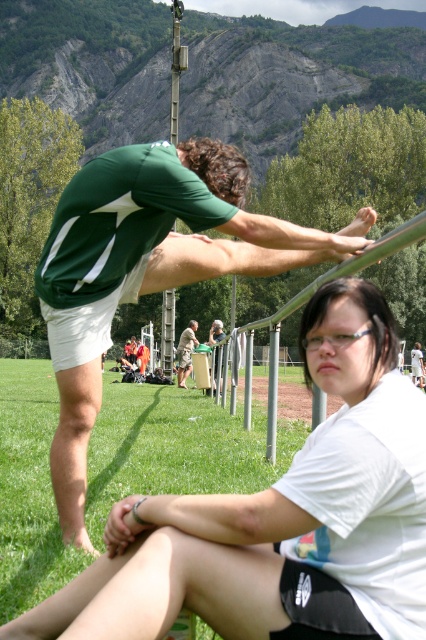
Question: Does white matte shirt at lower center appear over green fabric shirt at upper left?

Choices:
 (A) no
 (B) yes

Answer: (A)

Question: Which point is farther to the camera?

Choices:
 (A) white matte shirt at lower center
 (B) green fabric shirt at upper left
 (C) wooden bench at center

Answer: (C)

Question: Does green fabric shirt at upper left appear on the left side of wooden bench at center?

Choices:
 (A) yes
 (B) no

Answer: (B)

Question: Is white matte shirt at lower center below green fabric shirt at upper left?

Choices:
 (A) no
 (B) yes

Answer: (B)

Question: Which point appears farthest from the camera in this image?

Choices:
 (A) (416, 484)
 (B) (89, 364)
 (C) (192, 346)

Answer: (C)

Question: Which object is the closest to the green fabric shirt at upper left?

Choices:
 (A) white matte shirt at lower center
 (B) wooden bench at center

Answer: (A)